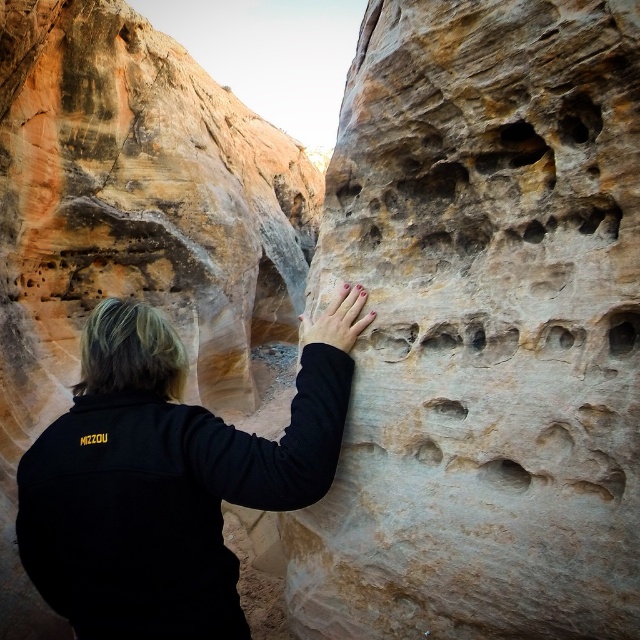
Measure the distance between smooth beige rock at center and camera.

smooth beige rock at center and camera are 24.90 meters apart from each other.

Which is in front, point (106, 280) or point (29, 470)?

Point (29, 470) is in front.

The height and width of the screenshot is (640, 640). In order to click on smooth beige rock at center in this screenshot , I will do `click(134, 228)`.

The width and height of the screenshot is (640, 640). I want to click on smooth beige rock at center, so click(x=134, y=228).

Between rustic stone handhold at center and smooth beige rock at center, which one has less height?

Standing shorter between the two is rustic stone handhold at center.

Does rustic stone handhold at center have a larger size compared to smooth beige rock at center?

Incorrect, rustic stone handhold at center is not larger than smooth beige rock at center.

Which is in front, point (417, 630) or point (144, 173)?

Point (417, 630) is more forward.

Find the location of a particular element. The image size is (640, 640). rustic stone handhold at center is located at coordinates (483, 328).

Based on the photo, can you confirm if rustic stone handhold at center is bigger than black fleece jacket at center?

Yes, rustic stone handhold at center is bigger than black fleece jacket at center.

Does rustic stone handhold at center come behind black fleece jacket at center?

No, rustic stone handhold at center is in front of black fleece jacket at center.

Between point (349, 253) and point (307, 397), which one is positioned in front?

Point (307, 397) is more forward.

What are the coordinates of `rustic stone handhold at center` in the screenshot? It's located at (483, 328).